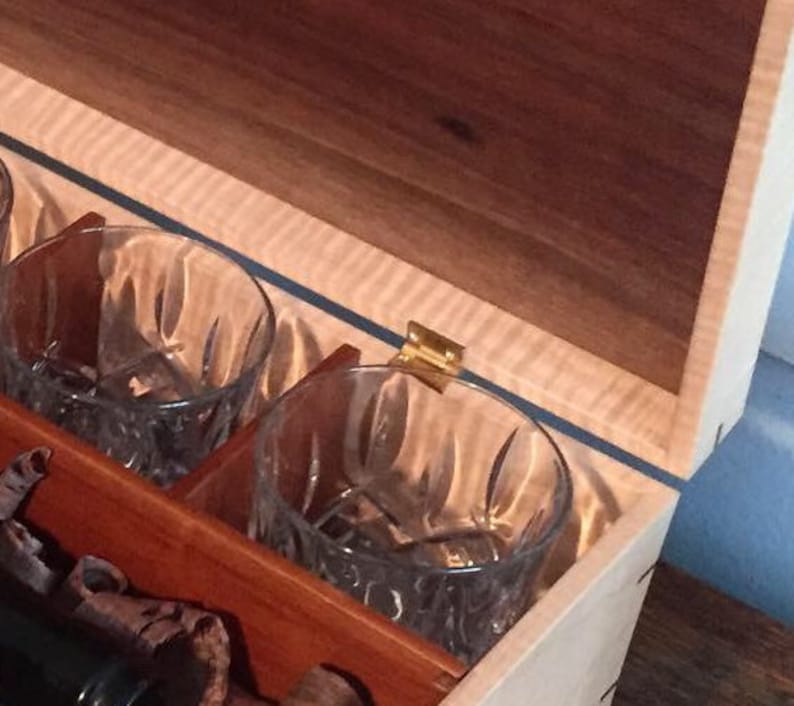
Locate an element on the screen. wall is located at coordinates (735, 515).